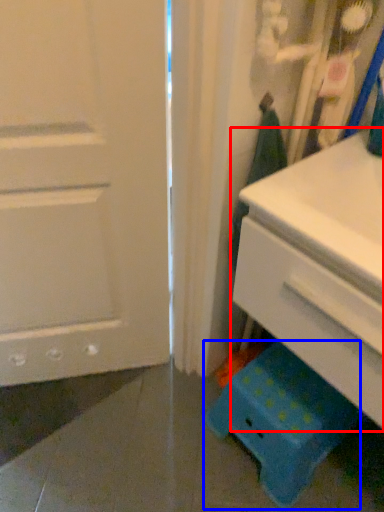
Question: Which of the following is the closest to the observer, chest of drawers (highlighted by a red box) or step stool (highlighted by a blue box)?

Choices:
 (A) chest of drawers
 (B) step stool

Answer: (A)